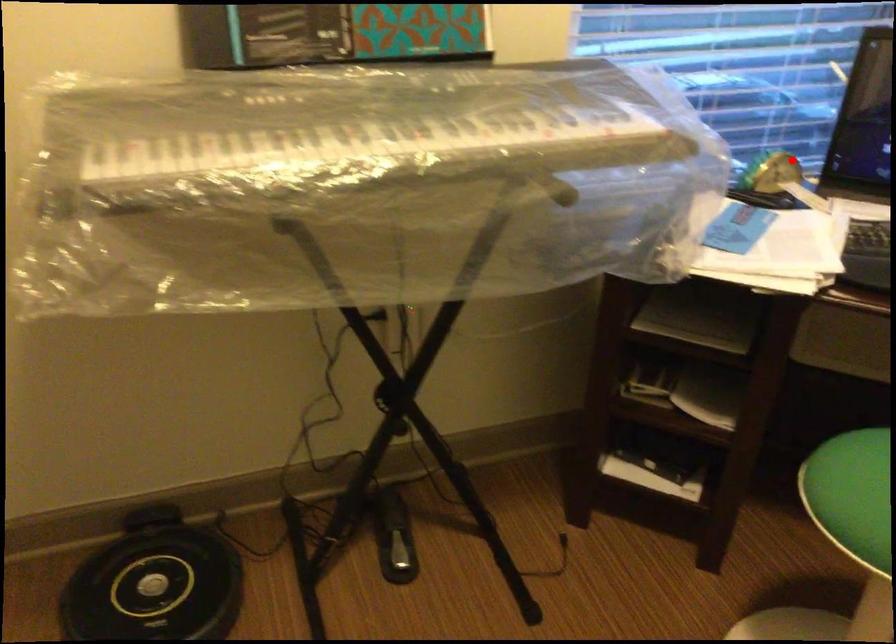
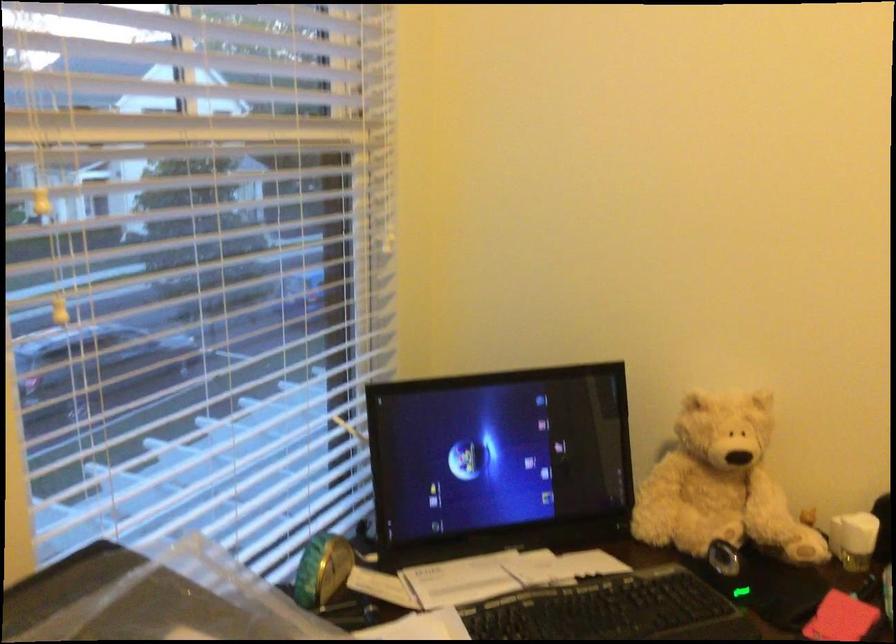
The point at the highlighted location is marked in the first image. Where is the corresponding point in the second image?

(322, 569)